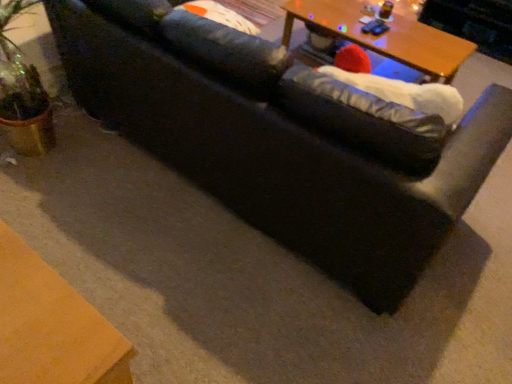
Question: From a real-world perspective, is white fabric bean bag at right below wooden table at upper center?

Choices:
 (A) no
 (B) yes

Answer: (A)

Question: Is white fabric bean bag at right shorter than wooden table at upper center?

Choices:
 (A) yes
 (B) no

Answer: (A)

Question: Could you tell me if white fabric bean bag at right is turned towards wooden table at upper center?

Choices:
 (A) yes
 (B) no

Answer: (B)

Question: Considering the relative positions of white fabric bean bag at right and wooden table at upper center in the image provided, is white fabric bean bag at right to the right of wooden table at upper center from the viewer's perspective?

Choices:
 (A) no
 (B) yes

Answer: (A)

Question: From the image's perspective, is white fabric bean bag at right beneath wooden table at upper center?

Choices:
 (A) no
 (B) yes

Answer: (B)

Question: Does white fabric bean bag at right have a larger size compared to wooden table at upper center?

Choices:
 (A) no
 (B) yes

Answer: (A)

Question: From a real-world perspective, is wooden table at upper center on white fabric bean bag at right?

Choices:
 (A) no
 (B) yes

Answer: (A)

Question: Is white fabric bean bag at right a part of wooden table at upper center?

Choices:
 (A) no
 (B) yes

Answer: (A)

Question: Can you confirm if wooden table at upper center is wider than white fabric bean bag at right?

Choices:
 (A) yes
 (B) no

Answer: (A)

Question: Is wooden table at upper center next to white fabric bean bag at right?

Choices:
 (A) no
 (B) yes

Answer: (A)

Question: Is the depth of wooden table at upper center greater than that of white fabric bean bag at right?

Choices:
 (A) yes
 (B) no

Answer: (A)

Question: From the image's perspective, is wooden table at upper center under white fabric bean bag at right?

Choices:
 (A) yes
 (B) no

Answer: (B)

Question: Is wooden table at upper center in front of or behind white fabric bean bag at right in the image?

Choices:
 (A) behind
 (B) front

Answer: (A)